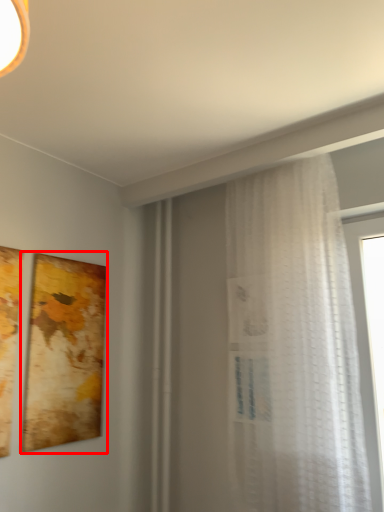
Question: From the image's perspective, where is picture frame (annotated by the red box) located in relation to curtain in the image?

Choices:
 (A) below
 (B) above

Answer: (A)